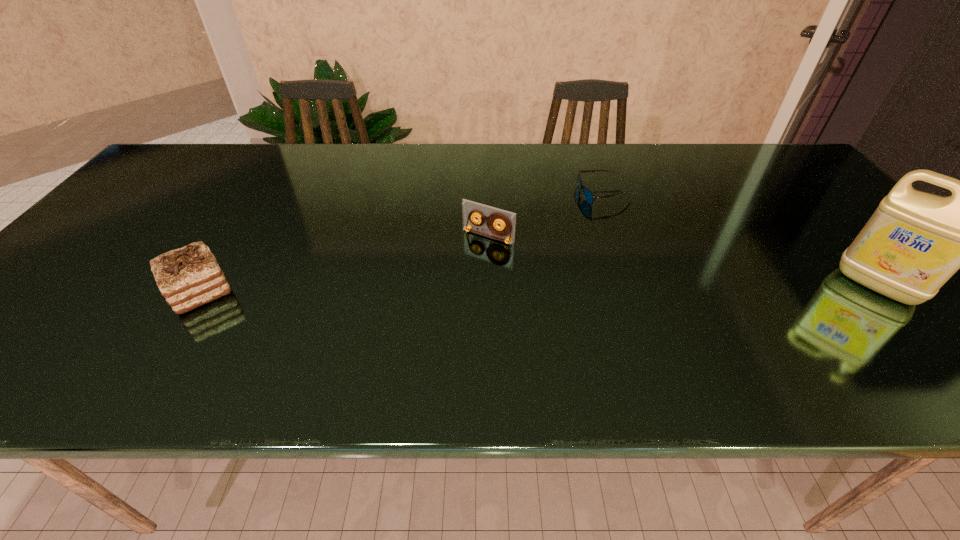
Where is `chocolate cake`? This screenshot has width=960, height=540. chocolate cake is located at coordinates (188, 277).

The width and height of the screenshot is (960, 540). Identify the location of detergent. (915, 241).

The image size is (960, 540). Identify the location of the rightmost object. (915, 241).

Locate an element on the screen. This screenshot has height=540, width=960. the farthest object is located at coordinates (588, 195).

At what (x,y) coordinates should I click in order to perform the action: click on the third object from left to right. Please return your answer as a coordinate pair (x, y). Image resolution: width=960 pixels, height=540 pixels. Looking at the image, I should click on (588, 195).

Identify the location of the second shortest object. (506, 232).

Where is `videotape`? This screenshot has width=960, height=540. videotape is located at coordinates (506, 232).

At what (x,y) coordinates should I click in order to perform the action: click on free space located on the right of the leftmost object. Please return your answer as a coordinate pair (x, y). The height and width of the screenshot is (540, 960). Looking at the image, I should click on (351, 291).

Find the location of a particular element. Image resolution: width=960 pixels, height=540 pixels. vacant point located 0.090m on the left of the rightmost object is located at coordinates (803, 285).

Where is `free space located at the front of the third object from left to right showing the lenses`? This screenshot has width=960, height=540. free space located at the front of the third object from left to right showing the lenses is located at coordinates (496, 273).